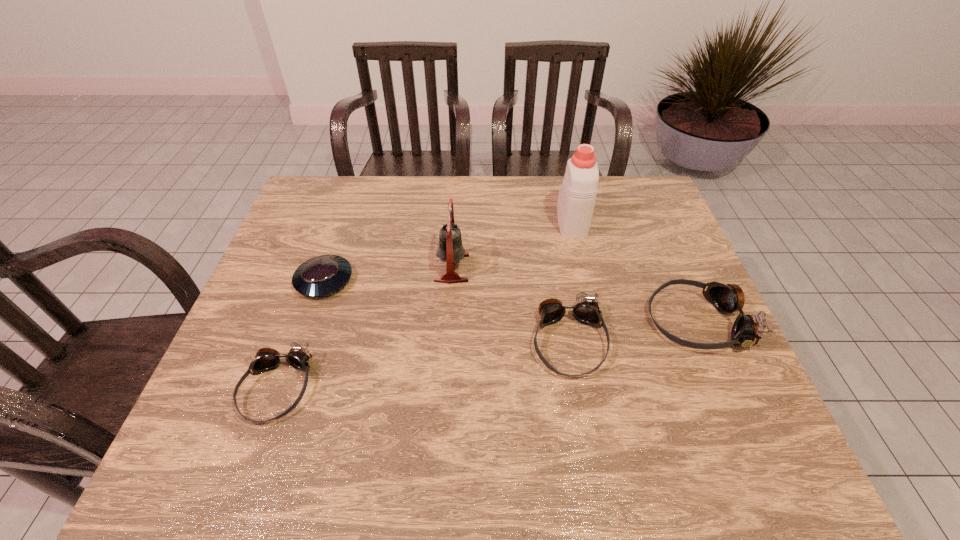
This screenshot has width=960, height=540. In order to click on the second shortest object in this screenshot , I will do `click(266, 359)`.

The image size is (960, 540). In order to click on the shortest goggles in this screenshot , I will do `click(266, 359)`.

This screenshot has height=540, width=960. I want to click on the second goggles from right to left, so click(x=586, y=310).

Identify the location of the fourth tallest object. [x=586, y=310].

You are a GUI agent. You are given a task and a screenshot of the screen. Output one action in this format:
    pyautogui.click(x=<x>, y=<y>)
    Task: Click on the rightmost goggles
    
    Given the screenshot: What is the action you would take?
    pyautogui.click(x=747, y=330)

Locate an element on the screen. The image size is (960, 540). the tallest object is located at coordinates (576, 200).

At what (x,y) coordinates should I click in order to perform the action: click on detergent. Please return your answer as a coordinate pair (x, y). The image size is (960, 540). Looking at the image, I should click on (576, 200).

Where is `saucer`? This screenshot has width=960, height=540. saucer is located at coordinates (323, 275).

At what (x,y) coordinates should I click in order to perform the action: click on the fifth shortest object. Please return your answer as a coordinate pair (x, y). Image resolution: width=960 pixels, height=540 pixels. Looking at the image, I should click on (450, 249).

At what (x,y) coordinates should I click in order to perform the action: click on bell. Please return your answer as a coordinate pair (x, y). Looking at the image, I should click on (450, 249).